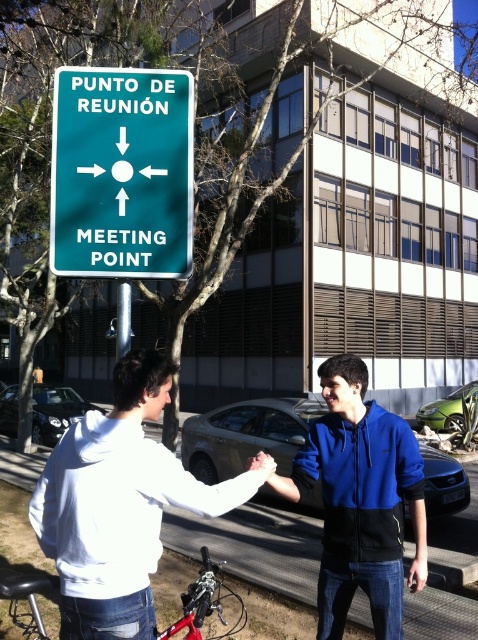
You are a delivery driver needing to park your car between the metallic gray sedan at center and the shiny black car at lower left. Can you fit your car there if your car is 15 feet long?

The distance between the metallic gray sedan at center and the shiny black car at lower left is 36.93 feet. Since your car is 15 feet long, there is enough space to park between them as 36.93 feet is greater than 15 feet.

You are a pedestrian who wants to cross the street safely. You see a metallic gray sedan at center and a shiny black car at lower left. Which car is closer to you?

The metallic gray sedan at center is closer to the viewer than the shiny black car at lower left, so the metallic gray sedan at center is the closer one.